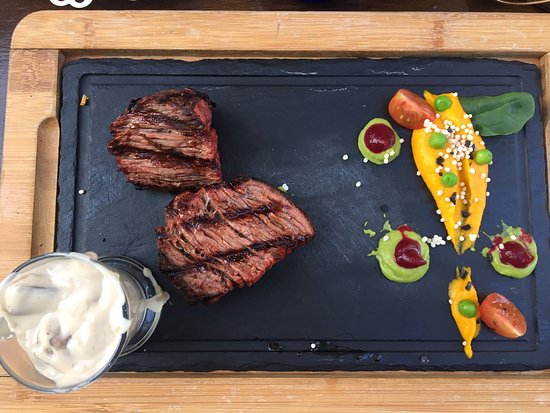
Identify the location of table. This screenshot has height=413, width=550. (10, 13).